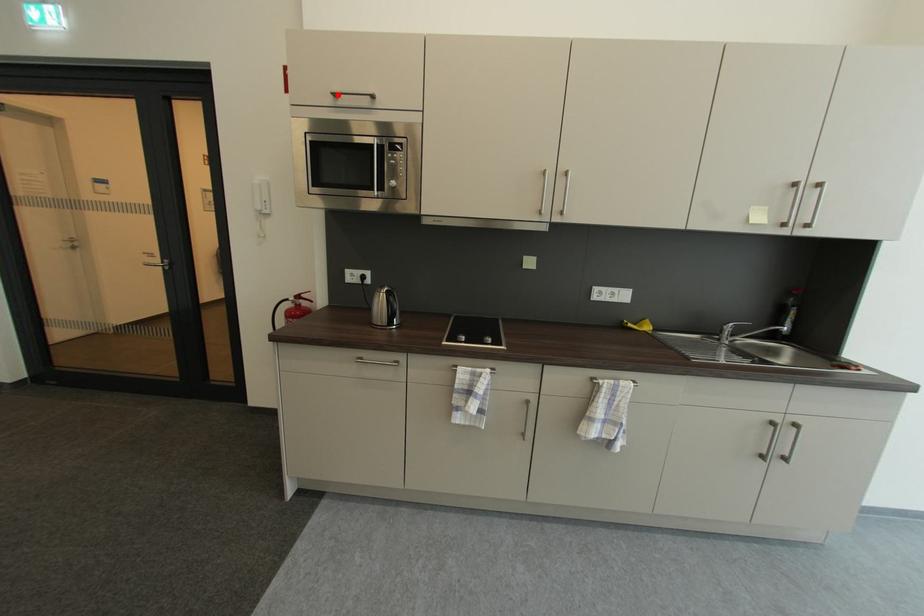
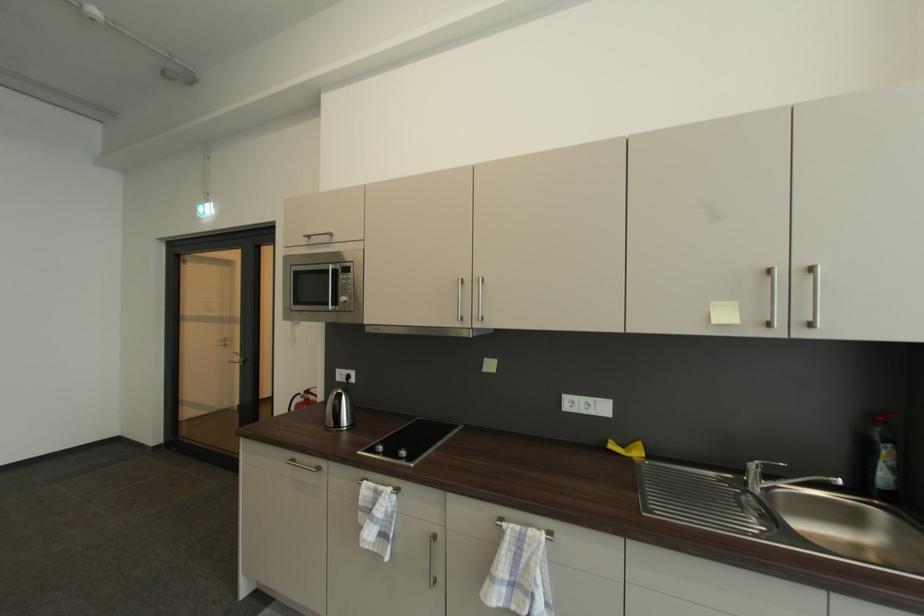
In the second image, find the point that corresponds to the highlighted location in the first image.

(311, 237)